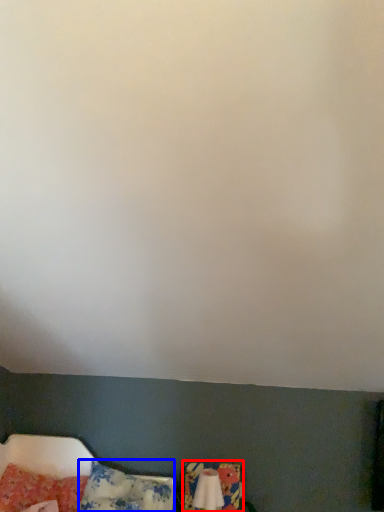
Question: Which of the following is the closest to the observer, swivel chair (highlighted by a red box) or pillow (highlighted by a blue box)?

Choices:
 (A) swivel chair
 (B) pillow

Answer: (B)